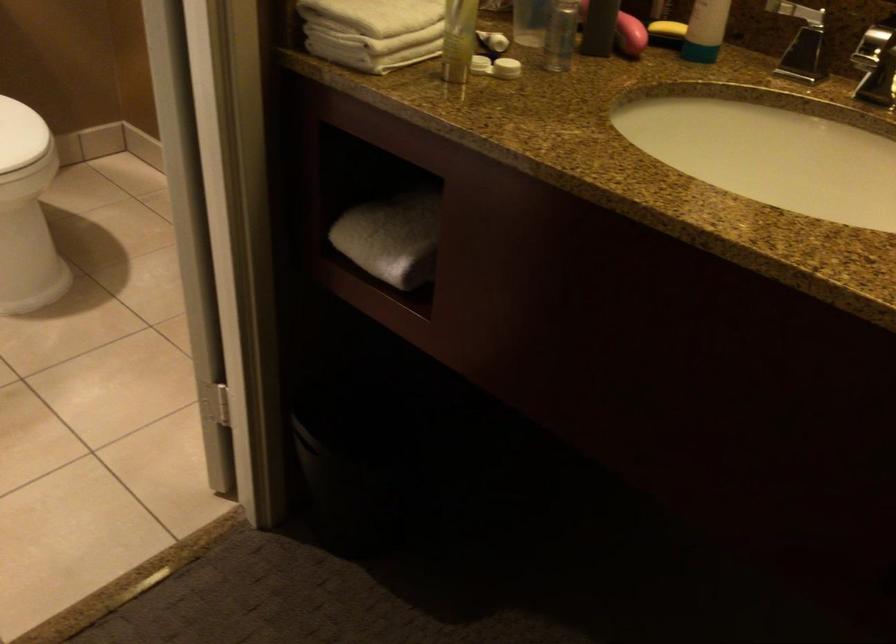
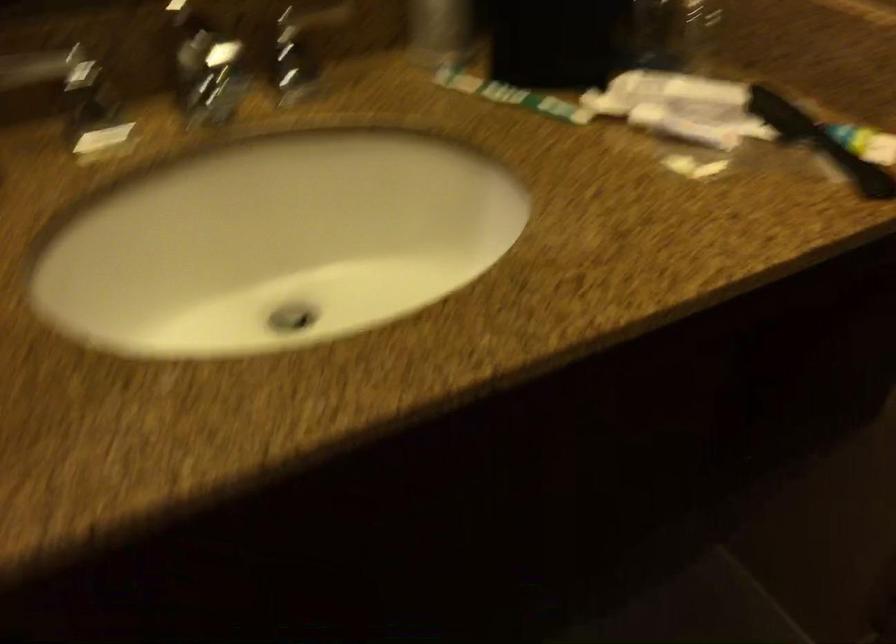
First-person continuous shooting, in which direction is the camera rotating?

The camera rotated toward right-down.